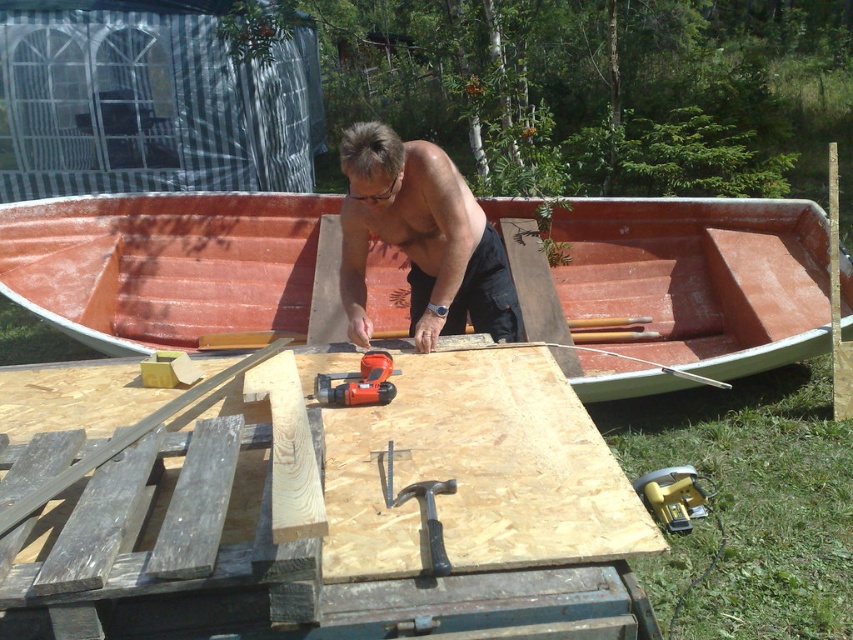
Question: Is shiny orange boat at center to the left of orange plastic drill at center from the viewer's perspective?

Choices:
 (A) yes
 (B) no

Answer: (B)

Question: Is orange painted wood canoe at center to the right of gold metallic nail gun at lower right from the viewer's perspective?

Choices:
 (A) no
 (B) yes

Answer: (B)

Question: Which of the following is the closest to the observer?

Choices:
 (A) (445, 568)
 (B) (370, 356)
 (C) (647, 504)
 (D) (421, 346)

Answer: (A)

Question: Is shiny orange boat at center positioned in front of orange plastic drill at center?

Choices:
 (A) yes
 (B) no

Answer: (B)

Question: Estimate the real-world distances between objects in this image. Which object is farther from the orange painted wood canoe at center?

Choices:
 (A) shiny orange boat at center
 (B) black rubber hammer at center

Answer: (B)

Question: Which of these objects is positioned closest to the gold metallic nail gun at lower right?

Choices:
 (A) black rubber hammer at center
 (B) orange plastic drill at center
 (C) shiny orange boat at center

Answer: (C)